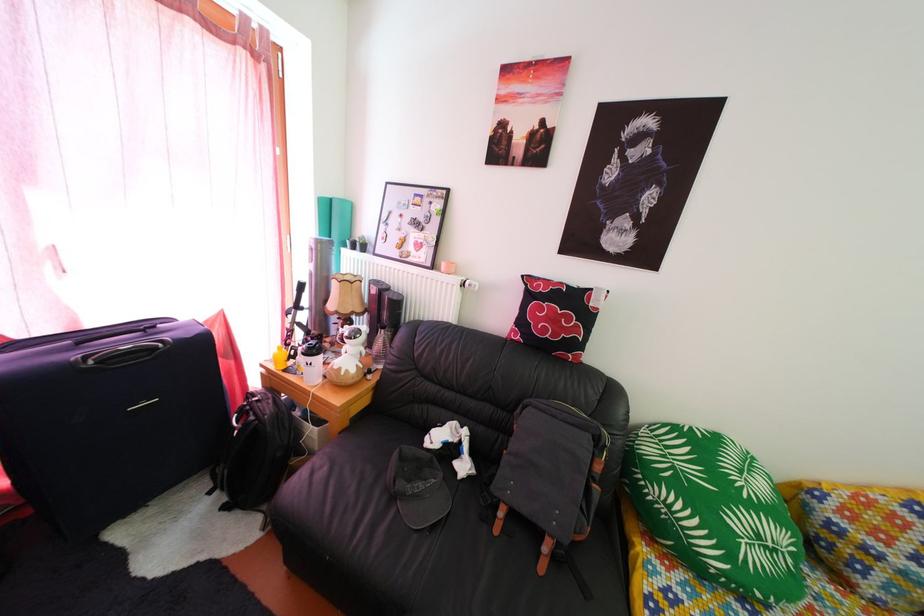
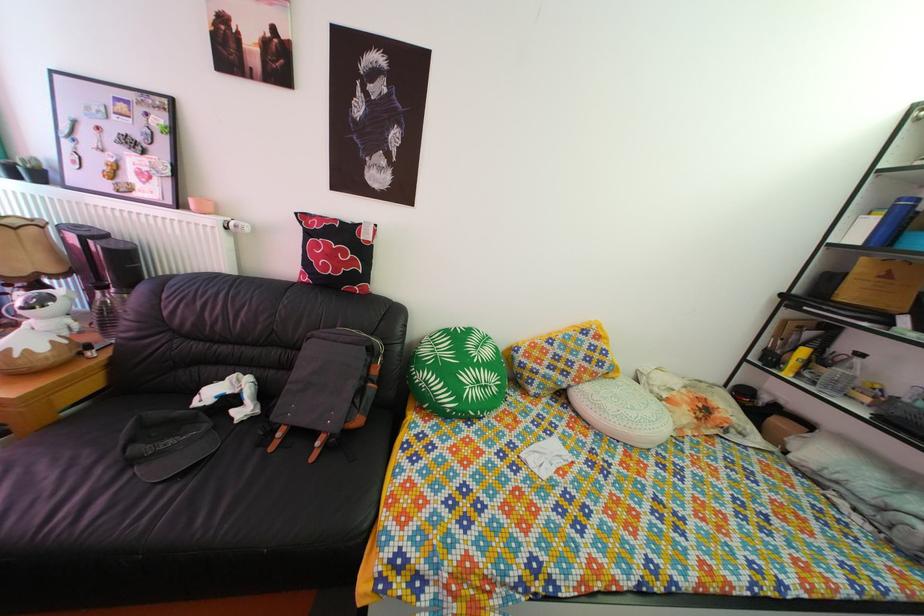
Locate, in the second image, the point that corresponds to point 505,540 in the first image.

(281, 456)